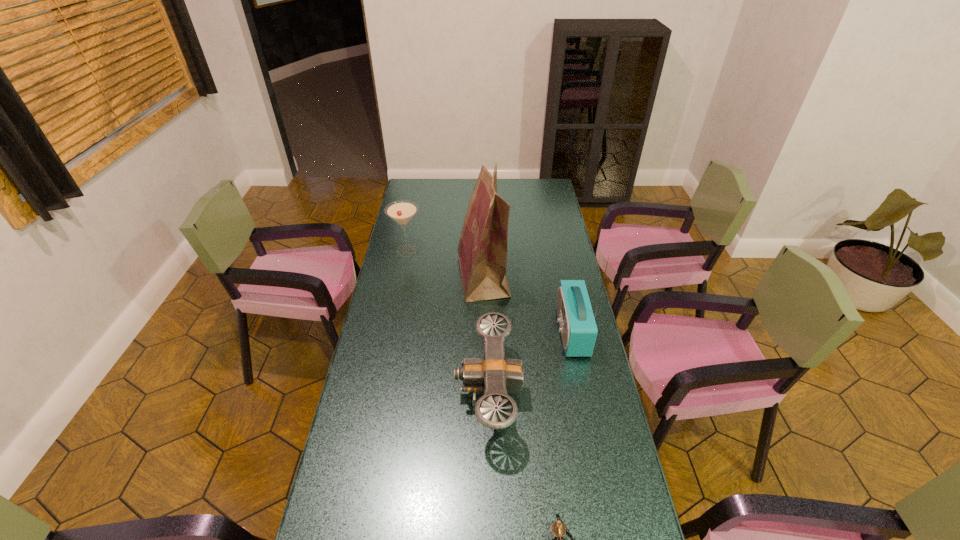
This screenshot has height=540, width=960. I want to click on vacant space located 0.060m on the front panel of the radio receiver, so click(541, 331).

The image size is (960, 540). I want to click on vacant point located on the front of the martini, so point(402,276).

I want to click on vacant region located on the front-facing side of the second shortest object, so click(x=386, y=393).

Locate an element on the screen. This screenshot has height=540, width=960. blank space located 0.270m on the front-facing side of the second shortest object is located at coordinates (374, 393).

Identify the location of free space located on the front-facing side of the second shortest object. (401, 393).

Locate an element on the screen. The width and height of the screenshot is (960, 540). object at the left edge is located at coordinates (402, 211).

Find the location of a particular element. object present at the right edge is located at coordinates (578, 328).

Locate an element on the screen. The width and height of the screenshot is (960, 540). free space at the left edge is located at coordinates (387, 279).

In the image, there is a desktop. Find the location of `vacant area at the right edge`. vacant area at the right edge is located at coordinates (534, 219).

Find the location of a particular element. Image resolution: width=960 pixels, height=540 pixels. vacant space at the far left corner is located at coordinates (415, 179).